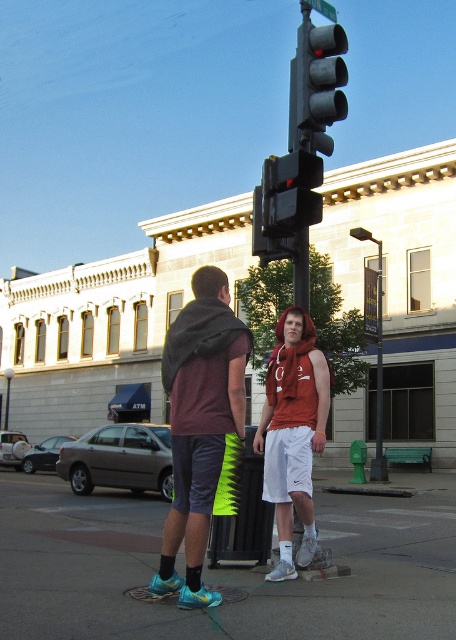
Does matte maroon t-shirt at center have a lesser height compared to metallic gray traffic light at upper center?

Indeed, matte maroon t-shirt at center has a lesser height compared to metallic gray traffic light at upper center.

Is point (187, 452) positioned in front of point (311, 76)?

Yes, it is in front of point (311, 76).

The height and width of the screenshot is (640, 456). Identify the location of matte maroon t-shirt at center. (202, 428).

Consider the image. Is matte red hoodie at center bigger than metallic black traffic light at center?

No.

Is matte red hoodie at center in front of metallic black traffic light at center?

Yes, matte red hoodie at center is in front of metallic black traffic light at center.

At what (x,y) coordinates should I click in order to perform the action: click on matte red hoodie at center. Please return your answer as a coordinate pair (x, y). Looking at the image, I should click on (293, 433).

Is matte maroon t-shirt at center to the right of metallic black traffic light at center from the viewer's perspective?

No, matte maroon t-shirt at center is not to the right of metallic black traffic light at center.

Is matte maroon t-shirt at center behind metallic black traffic light at center?

No, it is not.

Is point (208, 384) positioned before point (285, 205)?

Yes, it is.

What are the coordinates of `matte maroon t-shirt at center` in the screenshot? It's located at (202, 428).